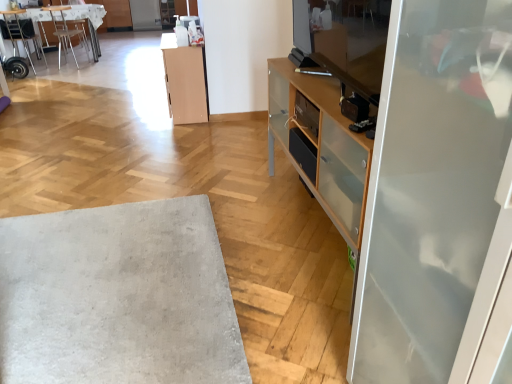
Question: Looking at their shapes, would you say light wood cabinet at center is wider or thinner than metallic silver chair at upper left, the first chair viewed from the left?

Choices:
 (A) wide
 (B) thin

Answer: (B)

Question: Considering the positions of point (198, 59) and point (15, 52), is point (198, 59) closer or farther from the camera than point (15, 52)?

Choices:
 (A) closer
 (B) farther

Answer: (A)

Question: Based on their relative distances, which object is farther from the metallic silver chair at upper left, which ranks as the 2th chair in left-to-right order?

Choices:
 (A) metallic silver chair at upper left, the 2th chair positioned from the right
 (B) transparent glass screen door at right, the 2th screen door when ordered from top to bottom
 (C) white soft rug at lower left
 (D) wooden textured desk at upper left
 (E) light wood cabinet at center

Answer: (B)

Question: Which of these objects is positioned closest to the metallic silver chair at upper left, which ranks as the first chair in right-to-left order?

Choices:
 (A) white soft rug at lower left
 (B) clear glass screen door at upper center, which ranks as the 1th screen door in top-to-bottom order
 (C) wooden textured desk at upper left
 (D) light wood cabinet at center
 (E) metallic silver chair at upper left, the 2th chair positioned from the right

Answer: (C)